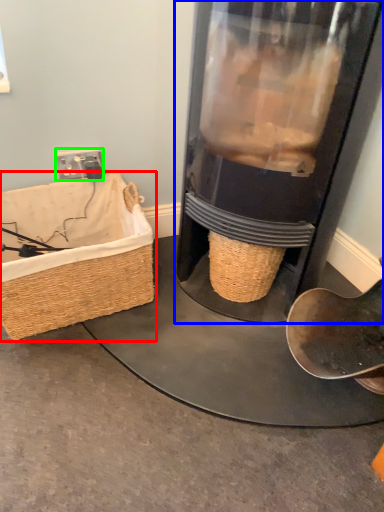
Question: Estimate the real-world distances between objects in this image. Which object is farther from picnic basket (highlighted by a red box), appliance (highlighted by a blue box) or plug (highlighted by a green box)?

Choices:
 (A) appliance
 (B) plug

Answer: (A)